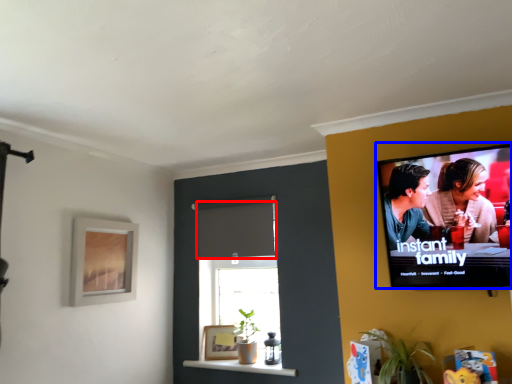
Question: Which of the following is the farthest to the observer, curtain (highlighted by a red box) or television (highlighted by a blue box)?

Choices:
 (A) curtain
 (B) television

Answer: (A)